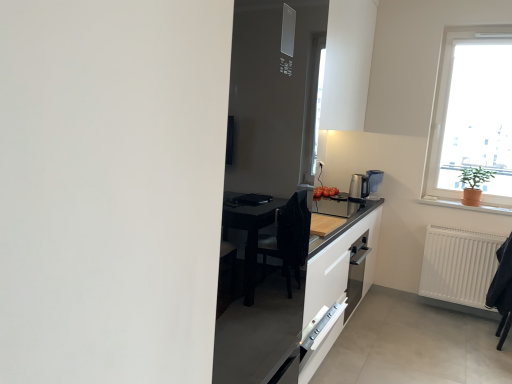
Question: Is white plastic electric outlet at upper center in front of or behind satin silver coffee machine at right in the image?

Choices:
 (A) behind
 (B) front

Answer: (A)

Question: Considering the positions of point (318, 160) and point (353, 185), is point (318, 160) closer or farther from the camera than point (353, 185)?

Choices:
 (A) farther
 (B) closer

Answer: (A)

Question: Which object is the farthest from the white plastic electric outlet at upper center?

Choices:
 (A) green matte plant at upper right
 (B) white glass window at upper right
 (C) orange clay pot at right
 (D) satin silver coffee machine at right
 (E) white matte radiator at lower right

Answer: (E)

Question: Considering the real-world distances, which object is closest to the white plastic electric outlet at upper center?

Choices:
 (A) orange clay pot at right
 (B) satin silver coffee machine at right
 (C) green matte plant at upper right
 (D) white glass window at upper right
 (E) white matte radiator at lower right

Answer: (B)